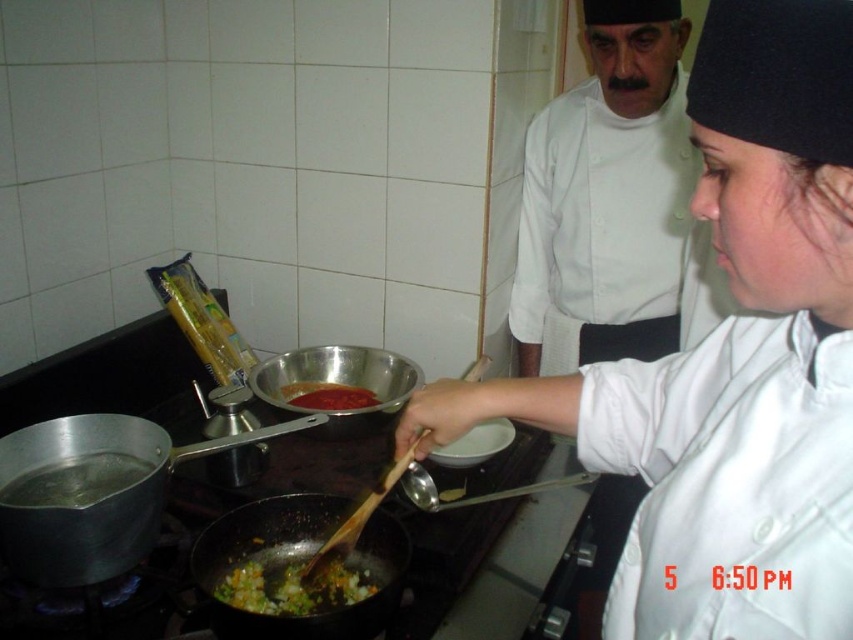
Who is lower down, metallic silver wok at center or chopped vegetables at center?

Positioned lower is chopped vegetables at center.

Is metallic silver wok at center above chopped vegetables at center?

Yes, metallic silver wok at center is above chopped vegetables at center.

Find the location of a particular element. The image size is (853, 640). metallic silver wok at center is located at coordinates (337, 385).

Who is more forward, (x=128, y=474) or (x=329, y=605)?

Point (x=329, y=605) is more forward.

Who is lower down, shiny black wok at lower center or chopped vegetables at center?

chopped vegetables at center

Image resolution: width=853 pixels, height=640 pixels. Identify the location of shiny black wok at lower center. (94, 492).

Who is higher up, black non-stick wok at center or metallic silver wok at center?

metallic silver wok at center

How far apart are black non-stick wok at center and metallic silver wok at center?

black non-stick wok at center is 12.56 inches away from metallic silver wok at center.

Image resolution: width=853 pixels, height=640 pixels. What do you see at coordinates (299, 563) in the screenshot? I see `black non-stick wok at center` at bounding box center [299, 563].

Locate an element on the screen. This screenshot has height=640, width=853. black non-stick wok at center is located at coordinates (299, 563).